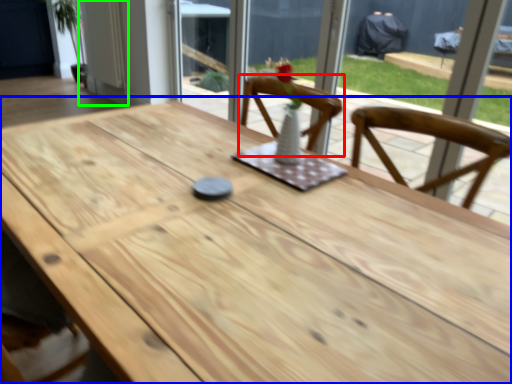
Question: Based on their relative distances, which object is farther from chair (highlighted by a red box)? Choose from table (highlighted by a blue box) and door (highlighted by a green box).

Choices:
 (A) table
 (B) door

Answer: (B)